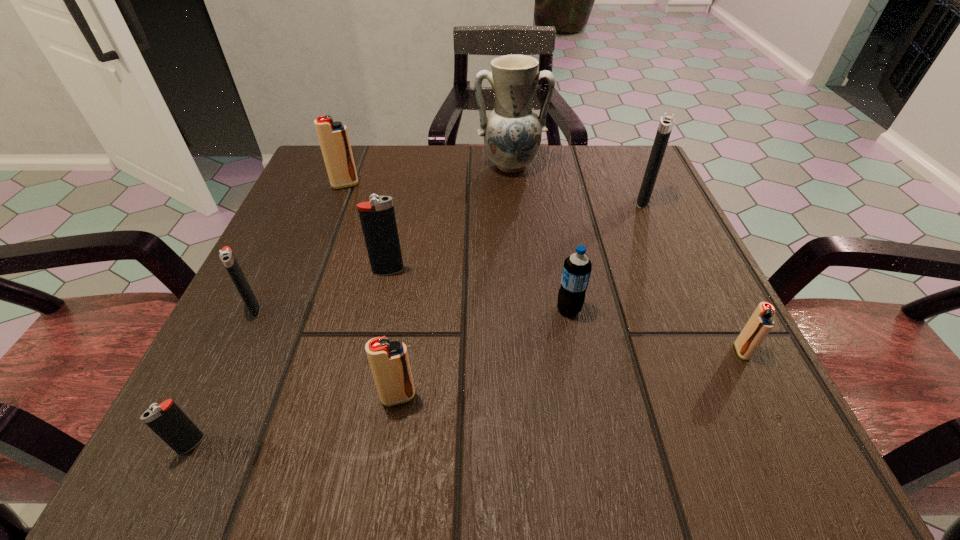
Image resolution: width=960 pixels, height=540 pixels. Find the location of `pottery`. pottery is located at coordinates (512, 132).

Locate an element on the screen. the biggest black igniter is located at coordinates (667, 121).

Where is `the tallest igniter`? The image size is (960, 540). the tallest igniter is located at coordinates pyautogui.click(x=667, y=121).

Locate an element on the screen. Image resolution: width=960 pixels, height=540 pixels. the farthest igniter is located at coordinates (333, 137).

This screenshot has height=540, width=960. I want to click on the fifth igniter from right to left, so coord(333,137).

Identify the location of the third smallest black igniter. This screenshot has width=960, height=540. point(377,217).

The image size is (960, 540). I want to click on the third black igniter from left to right, so tap(377, 217).

Where is `soda bottle`? soda bottle is located at coordinates (577, 267).

Locate an element on the screen. This screenshot has height=540, width=960. the second nearest black igniter is located at coordinates (226, 255).

I want to click on the fourth nearest igniter, so click(x=226, y=255).